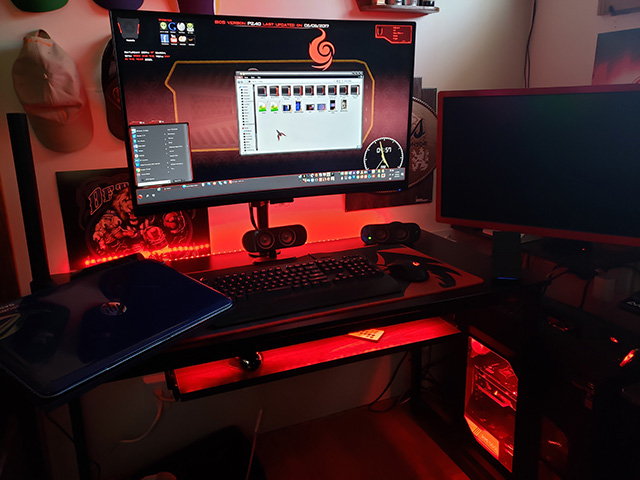
Image resolution: width=640 pixels, height=480 pixels. I want to click on computer tower, so click(x=516, y=360).